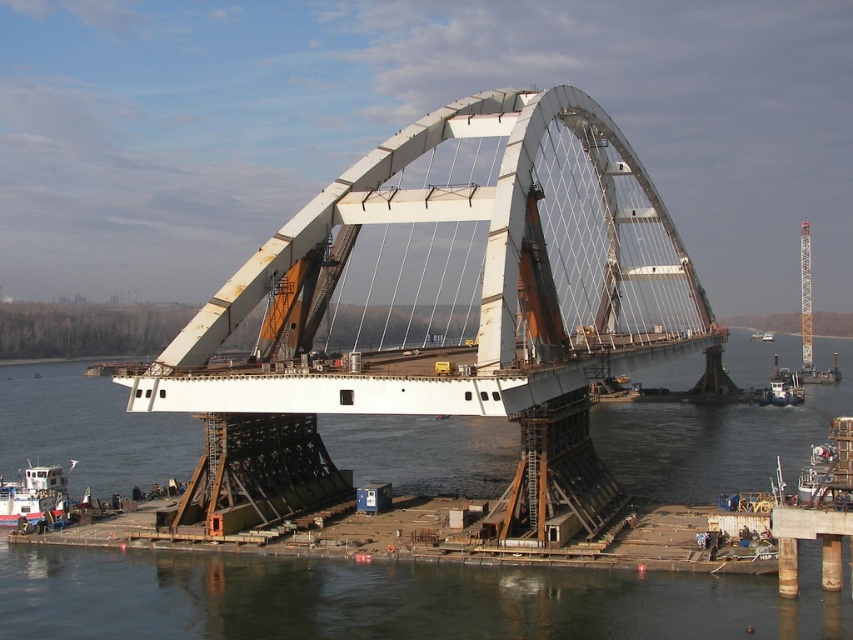
You are a construction inspector who needs to ensure safety standards are met. The white metallic arch bridge at center and the dark gray water at center are both part of the construction site. Based on their heights, which one poses a higher risk for falling objects hitting the water below?

The white metallic arch bridge at center is much taller than the dark gray water at center, so falling objects from the bridge would have a greater potential impact force when hitting the water below, posing a higher risk.

You are a construction worker on the bridge deck and need to move a white matte boat at lower right to the center of the bridge. Since the dark gray water at center is wider than the boat, will there be enough space for the boat to fit in the center?

The dark gray water at center is wider than the white matte boat at lower right, so there is enough space for the boat to fit in the center.

You are a construction engineer assessing the bridge site. You need to determine if the white metallic arch bridge at center can be widened to match the width of the dark gray water at center. Based on the current dimensions, what is your recommendation?

The white metallic arch bridge at center is currently narrower than the dark gray water at center. Since the bridge is still under construction, it is possible to widen it to match the water width by extending the deck sections and reinforcing the supporting structures as needed.